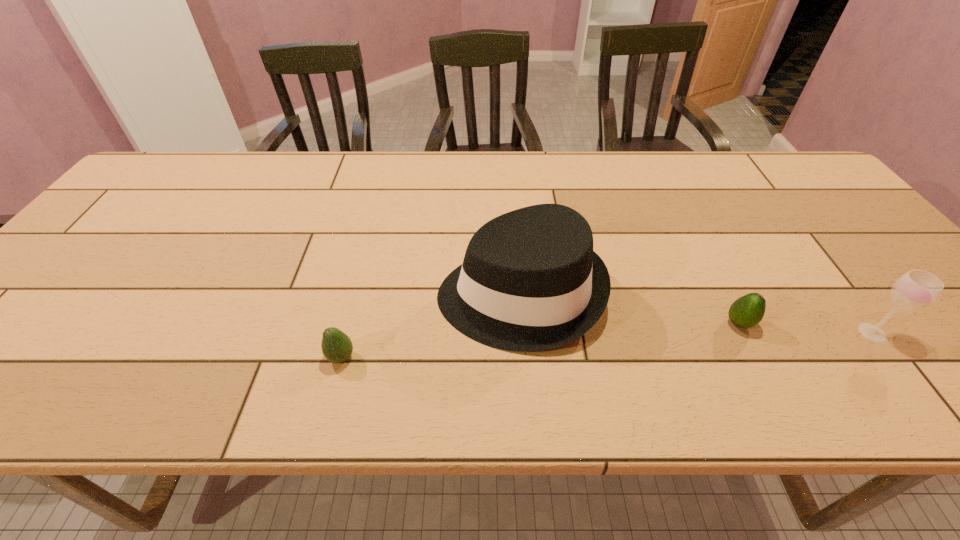
This screenshot has height=540, width=960. I want to click on vacant space located 0.250m on the left of the right avocado, so click(x=609, y=323).

The width and height of the screenshot is (960, 540). What are the coordinates of `vacant space situated on the left of the nearer avocado` in the screenshot? It's located at (282, 357).

At what (x,y) coordinates should I click in order to perform the action: click on object at the near edge. Please return your answer as a coordinate pair (x, y). Image resolution: width=960 pixels, height=540 pixels. Looking at the image, I should click on (337, 347).

Locate an element on the screen. The image size is (960, 540). object that is at the right edge is located at coordinates (916, 289).

The image size is (960, 540). I want to click on blank area at the far edge, so click(x=725, y=165).

In the image, there is a desktop. What are the coordinates of `blank space at the near edge` in the screenshot? It's located at (868, 378).

This screenshot has width=960, height=540. I want to click on free space at the left edge of the desktop, so click(18, 345).

Identify the location of free location at the right edge of the desktop. (866, 233).

Where is `vacant area that lies between the wineglass and the nearer avocado`? vacant area that lies between the wineglass and the nearer avocado is located at coordinates (607, 345).

Find the location of `free area in between the farther avocado and the rightmost object`. free area in between the farther avocado and the rightmost object is located at coordinates (805, 328).